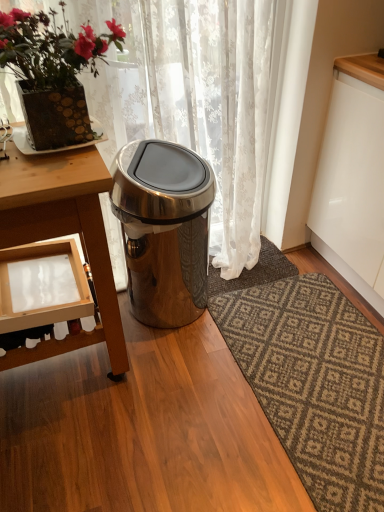
Locate an element on the screen. This screenshot has height=512, width=384. vacant space in front of white lace curtain at upper center is located at coordinates (190, 420).